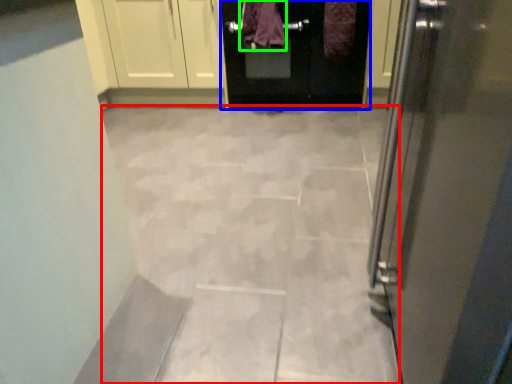
Question: Which object is the closest to the ceramic tile (highlighted by a red box)? Choose among these: door (highlighted by a blue box) or blanket (highlighted by a green box).

Choices:
 (A) door
 (B) blanket

Answer: (A)